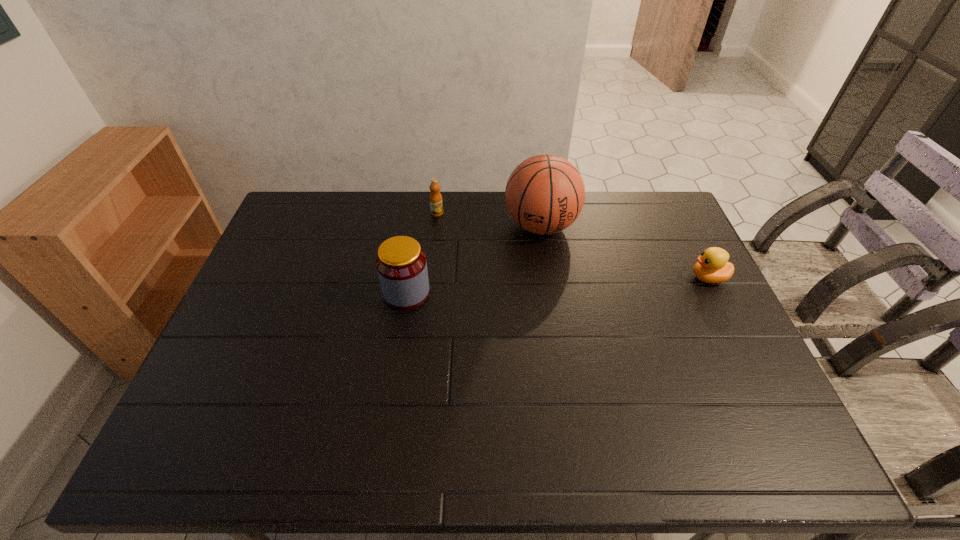
Identify the location of jar. (401, 264).

Image resolution: width=960 pixels, height=540 pixels. Identify the location of the shortest object. (712, 267).

Where is `duckling`? duckling is located at coordinates (712, 267).

At what (x,y) coordinates should I click in order to perform the action: click on basketball. Please return your answer as a coordinate pair (x, y). Image resolution: width=960 pixels, height=540 pixels. Looking at the image, I should click on (545, 194).

This screenshot has height=540, width=960. I want to click on the tallest object, so click(545, 194).

Locate an element on the screen. orange juice is located at coordinates (436, 204).

Find the location of a particular element. The height and width of the screenshot is (540, 960). free space located on the left of the jar is located at coordinates (306, 293).

Locate an element on the screen. The height and width of the screenshot is (540, 960). free space located on the face of the rightmost object is located at coordinates click(x=643, y=278).

Where is `vacant space located on the face of the rightmost object`? Image resolution: width=960 pixels, height=540 pixels. vacant space located on the face of the rightmost object is located at coordinates (578, 278).

The height and width of the screenshot is (540, 960). I want to click on vacant area situated on the face of the rightmost object, so click(x=562, y=278).